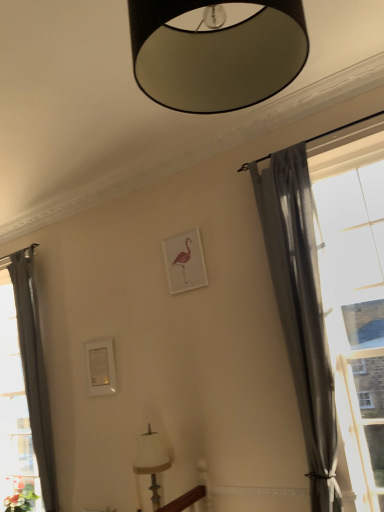
What do you see at coordinates (19, 497) in the screenshot? I see `green matte plant at lower left` at bounding box center [19, 497].

The height and width of the screenshot is (512, 384). What do you see at coordinates (34, 369) in the screenshot?
I see `gray sheer curtain at left, the 2th curtain in the right-to-left sequence` at bounding box center [34, 369].

What do you see at coordinates (301, 310) in the screenshot? I see `gray sheer curtain at right, the first curtain when ordered from right to left` at bounding box center [301, 310].

Describe the element at coordinates (151, 461) in the screenshot. I see `white fabric lampshade at lower center, which appears as the second lamp when viewed from the top` at that location.

Where is `white matte picture frame at center`? This screenshot has width=384, height=512. white matte picture frame at center is located at coordinates (185, 262).

This screenshot has width=384, height=512. What are the coordinates of `green matte plant at lower left` in the screenshot? It's located at (19, 497).

From a real-world perspective, is transparent glass window at right physically below gray sheer curtain at right, marked as the 1th curtain in a front-to-back arrangement?

Yes.

Considering the positions of points (355, 471) and (314, 396), is point (355, 471) farther from camera compared to point (314, 396)?

No, it is not.

Is transparent glass window at right beside gray sheer curtain at right, the first curtain when ordered from right to left?

No.

From a real-world perspective, is black matte lampshade at upper center, positioned as the first lamp in front-to-back order, physically located above or below white fabric lampshade at lower center, which appears as the second lamp when viewed from the top?

black matte lampshade at upper center, positioned as the first lamp in front-to-back order, is above white fabric lampshade at lower center, which appears as the second lamp when viewed from the top.

Considering the sizes of objects black matte lampshade at upper center, the 1th lamp when ordered from top to bottom, and white fabric lampshade at lower center, which is the second lamp from front to back, in the image provided, who is wider, black matte lampshade at upper center, the 1th lamp when ordered from top to bottom, or white fabric lampshade at lower center, which is the second lamp from front to back,?

black matte lampshade at upper center, the 1th lamp when ordered from top to bottom, is wider.

Does black matte lampshade at upper center, positioned as the first lamp in front-to-back order, have a smaller size compared to white fabric lampshade at lower center, the first lamp when ordered from bottom to top?

Incorrect, black matte lampshade at upper center, positioned as the first lamp in front-to-back order, is not smaller in size than white fabric lampshade at lower center, the first lamp when ordered from bottom to top.

In terms of height, does gray sheer curtain at left, acting as the first curtain starting from the left, look taller or shorter compared to green matte plant at lower left?

In the image, gray sheer curtain at left, acting as the first curtain starting from the left, appears to be taller than green matte plant at lower left.

Can you tell me how much gray sheer curtain at left, which is counted as the first curtain, starting from the back, and green matte plant at lower left differ in facing direction?

There is a 9.1e-05-degree angle between the facing directions of gray sheer curtain at left, which is counted as the first curtain, starting from the back, and green matte plant at lower left.

From the picture: Is the surface of gray sheer curtain at left, acting as the first curtain starting from the left, in direct contact with green matte plant at lower left?

gray sheer curtain at left, acting as the first curtain starting from the left, and green matte plant at lower left are not in contact.

At what (x,y) coordinates should I click in order to perform the action: click on the 1st curtain to the right when counting from the green matte plant at lower left. Please return your answer as a coordinate pair (x, y). Image resolution: width=384 pixels, height=512 pixels. Looking at the image, I should click on (34, 369).

From the image's perspective, relative to black matte lampshade at upper center, the second lamp in the bottom-to-top sequence, is gray sheer curtain at left, the second curtain positioned from the front, above or below?

Based on their image positions, gray sheer curtain at left, the second curtain positioned from the front, is located beneath black matte lampshade at upper center, the second lamp in the bottom-to-top sequence.

In the scene shown: From a real-world perspective, who is located lower, gray sheer curtain at left, the 2th curtain in the right-to-left sequence, or black matte lampshade at upper center, positioned as the first lamp in front-to-back order?

gray sheer curtain at left, the 2th curtain in the right-to-left sequence.

In the scene shown: Considering the sizes of gray sheer curtain at left, which is counted as the first curtain, starting from the back, and transparent glass window at right in the image, is gray sheer curtain at left, which is counted as the first curtain, starting from the back, bigger or smaller than transparent glass window at right?

Considering their sizes, gray sheer curtain at left, which is counted as the first curtain, starting from the back, takes up more space than transparent glass window at right.

How different are the orientations of gray sheer curtain at left, the 2th curtain in the right-to-left sequence, and transparent glass window at right in degrees?

The angle between the facing direction of gray sheer curtain at left, the 2th curtain in the right-to-left sequence, and the facing direction of transparent glass window at right is 8.34e-05 degrees.

Is gray sheer curtain at left, acting as the first curtain starting from the left, wider or thinner than transparent glass window at right?

Considering their sizes, gray sheer curtain at left, acting as the first curtain starting from the left, looks broader than transparent glass window at right.

How distant is gray sheer curtain at left, which is counted as the first curtain, starting from the back, from transparent glass window at right?

They are 2.58 meters apart.

In the image, there is a gray sheer curtain at right, the first curtain when ordered from right to left. What are the coordinates of `curtain below it (from the image's perspective)` in the screenshot? It's located at (34, 369).

Is gray sheer curtain at right, the first curtain when ordered from right to left, positioned with its back to gray sheer curtain at left, the second curtain positioned from the front?

No, gray sheer curtain at right, the first curtain when ordered from right to left, is not facing the opposite direction of gray sheer curtain at left, the second curtain positioned from the front.

In the scene shown: Is gray sheer curtain at right, marked as the 1th curtain in a front-to-back arrangement, to the left of gray sheer curtain at left, which is counted as the first curtain, starting from the back, from the viewer's perspective?

No.

Can you confirm if gray sheer curtain at right, which is the 2th curtain from back to front, is shorter than gray sheer curtain at left, the 2th curtain in the right-to-left sequence?

Correct, gray sheer curtain at right, which is the 2th curtain from back to front, is not as tall as gray sheer curtain at left, the 2th curtain in the right-to-left sequence.

Which is correct: transparent glass window at right is inside white matte picture frame at center, or outside of it?

transparent glass window at right is outside white matte picture frame at center.

Is transparent glass window at right oriented towards white matte picture frame at center?

No, transparent glass window at right does not turn towards white matte picture frame at center.

Who is shorter, transparent glass window at right or white matte picture frame at center?

Standing shorter between the two is white matte picture frame at center.

Locate an element on the screen. window lying on the right of gray sheer curtain at right, the second curtain from the left is located at coordinates (356, 301).

Image resolution: width=384 pixels, height=512 pixels. In the image, there is a white fabric lampshade at lower center, which is the second lamp from front to back. Identify the location of lamp above it (from the image's perspective). (216, 54).

Which object lies further to the anchor point gray sheer curtain at left, acting as the first curtain starting from the left, green matte plant at lower left or white matte picture frame at center?

white matte picture frame at center.

Considering their positions, is black matte lampshade at upper center, which ranks as the second lamp in back-to-front order, positioned closer to green matte plant at lower left than white fabric lampshade at lower center, the first lamp when ordered from bottom to top?

white fabric lampshade at lower center, the first lamp when ordered from bottom to top, is positioned closer to the anchor green matte plant at lower left.

Looking at the image, which one is located closer to black matte lampshade at upper center, positioned as the first lamp in front-to-back order, gray sheer curtain at left, the 2th curtain in the right-to-left sequence, or white fabric lampshade at lower center, which is the second lamp from front to back?

white fabric lampshade at lower center, which is the second lamp from front to back, is closer to black matte lampshade at upper center, positioned as the first lamp in front-to-back order.

From the image, which object appears to be farther from green matte plant at lower left, white matte picture frame at center or black matte lampshade at upper center, the second lamp in the bottom-to-top sequence?

black matte lampshade at upper center, the second lamp in the bottom-to-top sequence, lies further to green matte plant at lower left than the other object.

Considering their positions, is green matte plant at lower left positioned further to black matte lampshade at upper center, which ranks as the second lamp in back-to-front order, than white matte picture frame at center?

green matte plant at lower left lies further to black matte lampshade at upper center, which ranks as the second lamp in back-to-front order, than the other object.

Consider the image. When comparing their distances from white fabric lampshade at lower center, the first lamp when ordered from bottom to top, does green matte plant at lower left or gray sheer curtain at right, the second curtain from the left, seem closer?

Among the two, gray sheer curtain at right, the second curtain from the left, is located nearer to white fabric lampshade at lower center, the first lamp when ordered from bottom to top.

From the image, which object appears to be farther from gray sheer curtain at right, marked as the 1th curtain in a front-to-back arrangement, gray sheer curtain at left, acting as the first curtain starting from the left, or white matte picture frame at center?

gray sheer curtain at left, acting as the first curtain starting from the left, is further to gray sheer curtain at right, marked as the 1th curtain in a front-to-back arrangement.

When comparing their distances from black matte lampshade at upper center, the second lamp in the bottom-to-top sequence, does white matte picture frame at center or transparent glass window at right seem further?

white matte picture frame at center lies further to black matte lampshade at upper center, the second lamp in the bottom-to-top sequence, than the other object.

Find the location of `picture frame located between green matte plant at lower left and transparent glass window at right in the left-right direction`. picture frame located between green matte plant at lower left and transparent glass window at right in the left-right direction is located at coordinates (185, 262).

This screenshot has height=512, width=384. Find the location of `lamp that lies between white matte picture frame at center and green matte plant at lower left from top to bottom`. lamp that lies between white matte picture frame at center and green matte plant at lower left from top to bottom is located at coordinates (151, 461).

Where is `window between black matte lampshade at upper center, which ranks as the second lamp in back-to-front order, and white fabric lampshade at lower center, the 1th lamp when ordered from back to front, in the up-down direction`? window between black matte lampshade at upper center, which ranks as the second lamp in back-to-front order, and white fabric lampshade at lower center, the 1th lamp when ordered from back to front, in the up-down direction is located at coordinates (356, 301).

Identify the location of lamp located between black matte lampshade at upper center, positioned as the first lamp in front-to-back order, and white matte picture frame at center in the depth direction. This screenshot has height=512, width=384. (151, 461).